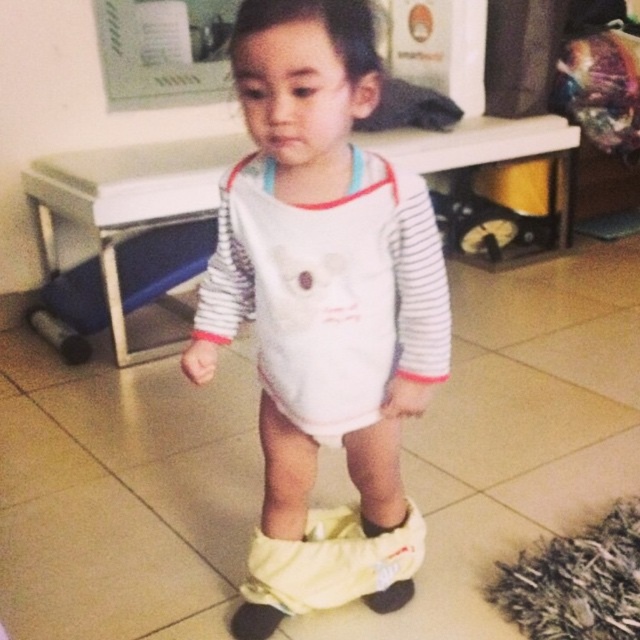
Is point (266, 618) more distant than point (371, 532)?

No, (266, 618) is in front of (371, 532).

Image resolution: width=640 pixels, height=640 pixels. Describe the element at coordinates (253, 620) in the screenshot. I see `black fuzzy sock at lower center` at that location.

At what (x,y) coordinates should I click in order to perform the action: click on black fuzzy sock at lower center. Please return your answer as a coordinate pair (x, y). Looking at the image, I should click on (253, 620).

Is white soft bib at center further to the viewer compared to yellow fabric sock at lower center?

No.

Who is more distant from viewer, (353, 244) or (392, 588)?

Positioned behind is point (392, 588).

Where is `white soft bib at center`? The height and width of the screenshot is (640, 640). white soft bib at center is located at coordinates (310, 291).

Based on the photo, which is more to the left, white soft onesie at center or white soft bib at center?

white soft bib at center is more to the left.

Is white soft onesie at center wider than white soft bib at center?

Yes, white soft onesie at center is wider than white soft bib at center.

Is point (332, 412) positioned before point (326, 339)?

No, (332, 412) is further to viewer.

Image resolution: width=640 pixels, height=640 pixels. Find the location of `white soft onesie at center`. white soft onesie at center is located at coordinates (323, 300).